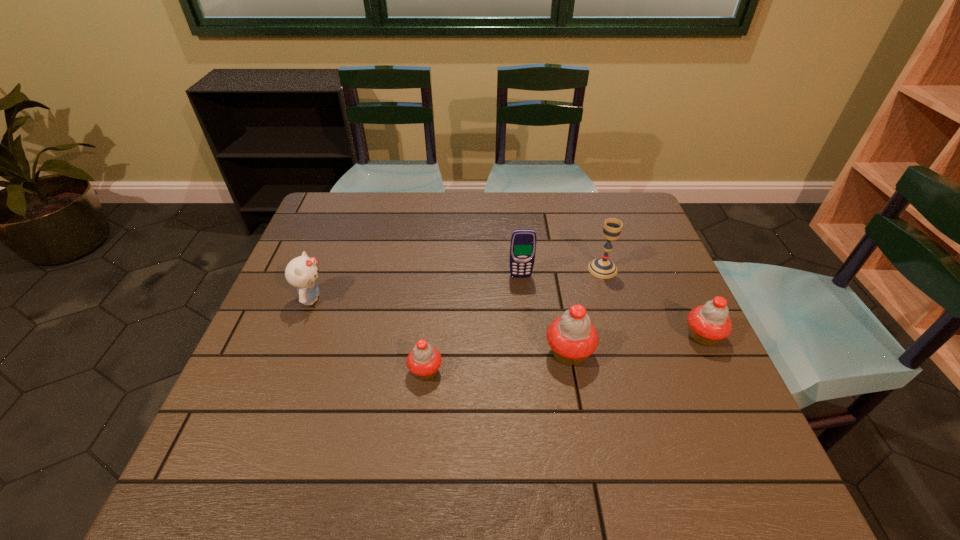
Observe the arrangement of all cupcakes in the image. To keep them evenly spaced, where would you place another cupcake on the left? Please locate a free space. Please provide its 2D coordinates. Your answer should be formatted as a tuple, i.e. [(x, y)], where the tuple contains the x and y coordinates of a point satisfying the conditions above.

[(271, 390)]